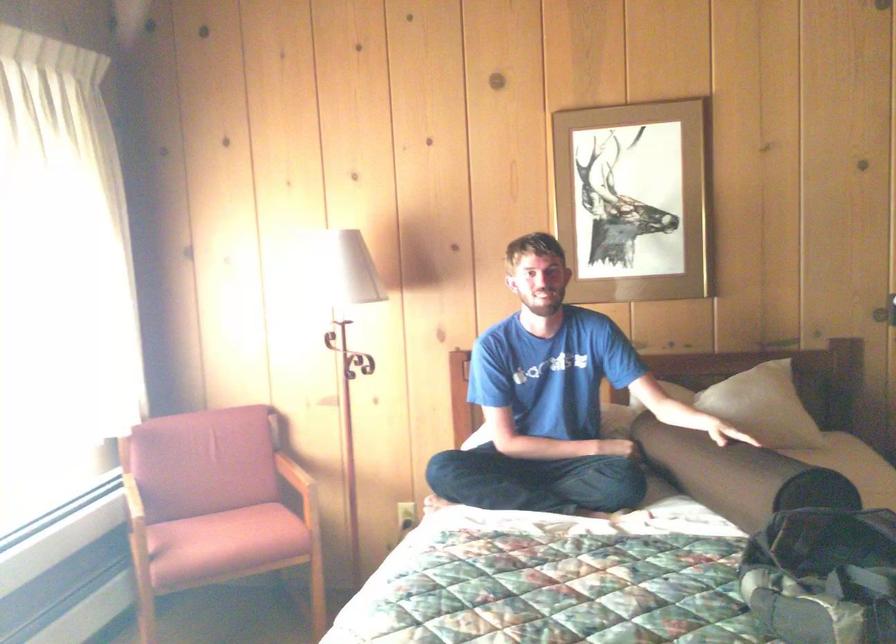
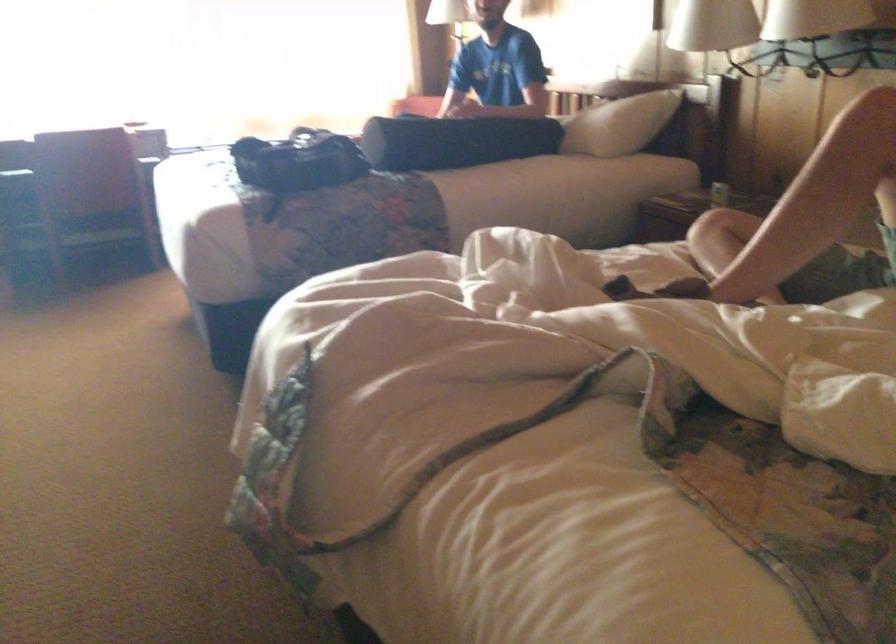
Question: I am providing you with two images of the same scene from different viewpoints. Which of the following objects are not visible in image2?

Choices:
 (A) black bolster pillow
 (B) fan control hub
 (C) white pillow
 (D) chair armrest

Answer: (D)